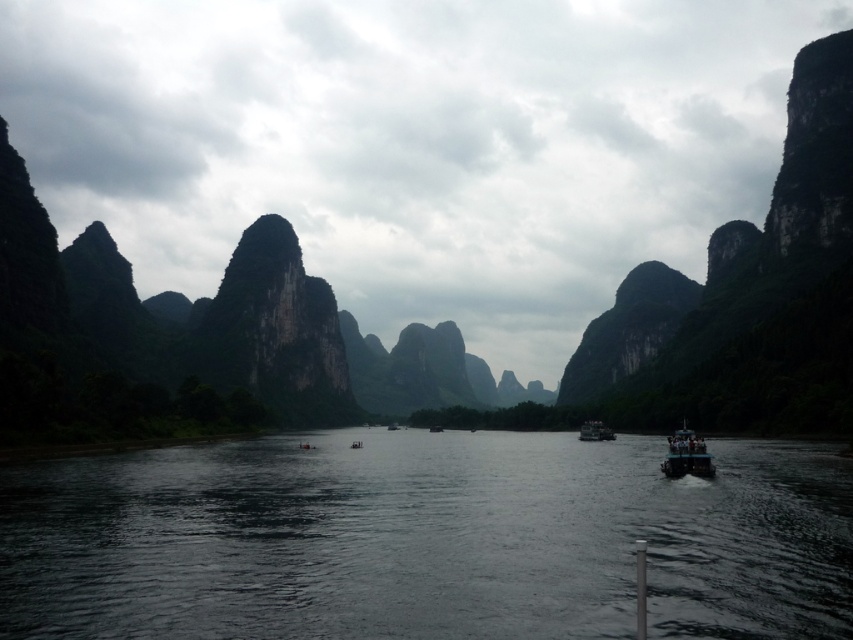
Between green rock formation at center and dark blue plastic boat at lower right, which one has more height?

Standing taller between the two is green rock formation at center.

This screenshot has height=640, width=853. What do you see at coordinates (746, 296) in the screenshot?
I see `green rock formation at center` at bounding box center [746, 296].

Who is more distant from viewer, (x=264, y=275) or (x=672, y=476)?

Positioned behind is point (x=264, y=275).

Find the location of `green rock formation at center`. green rock formation at center is located at coordinates (746, 296).

Who is lower down, dark water at center or dark blue plastic boat at lower right?

dark water at center is below.

Identify the location of dark water at center. This screenshot has width=853, height=640. (427, 540).

Is dark blue plastic boat at lower right shorter than dark blue plastic boat at center?

In fact, dark blue plastic boat at lower right may be taller than dark blue plastic boat at center.

What are the coordinates of `dark blue plastic boat at lower right` in the screenshot? It's located at (686, 456).

I want to click on dark blue plastic boat at lower right, so click(686, 456).